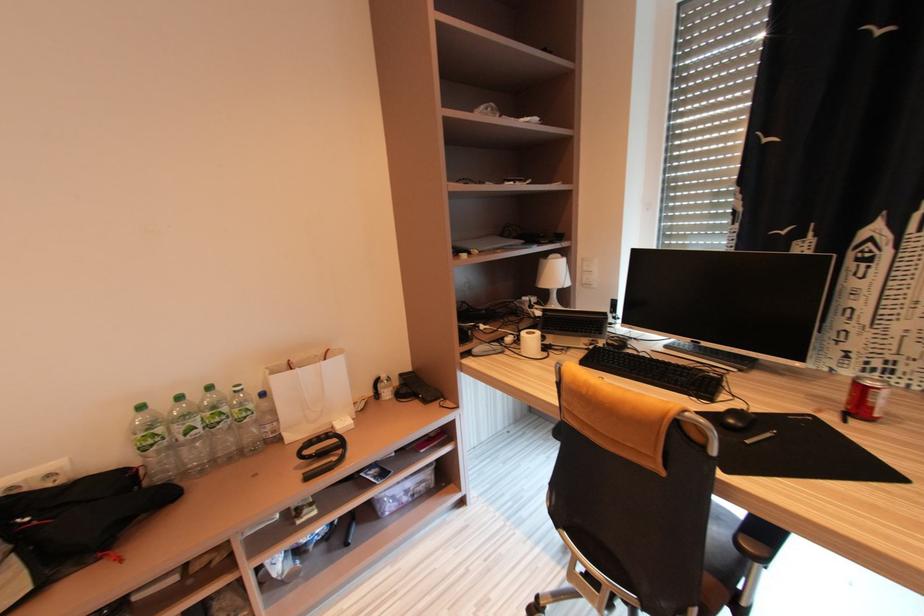
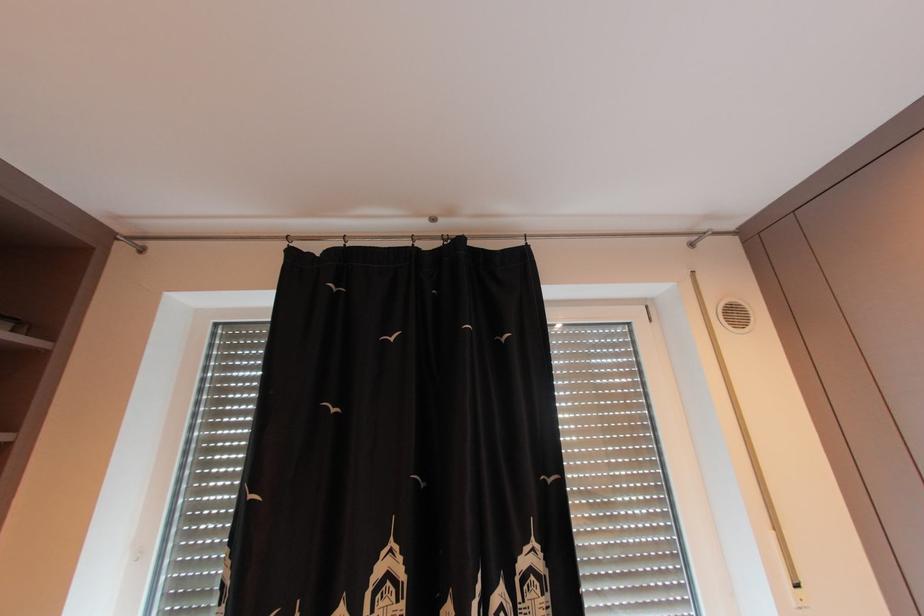
Based on the continuous images, in which direction is the camera rotating?

The camera's rotation is toward right-up.